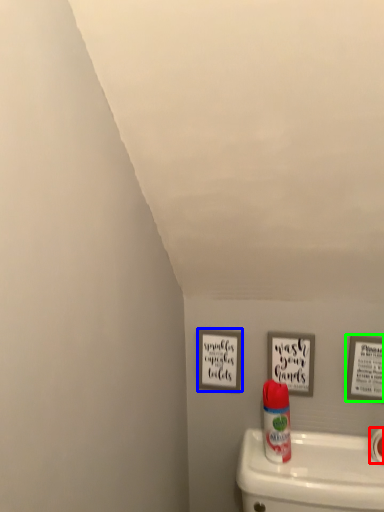
Question: Based on their relative distances, which object is farther from toilet paper (highlighted by a red box)? Choose from picture frame (highlighted by a blue box) and picture frame (highlighted by a green box).

Choices:
 (A) picture frame
 (B) picture frame

Answer: (A)